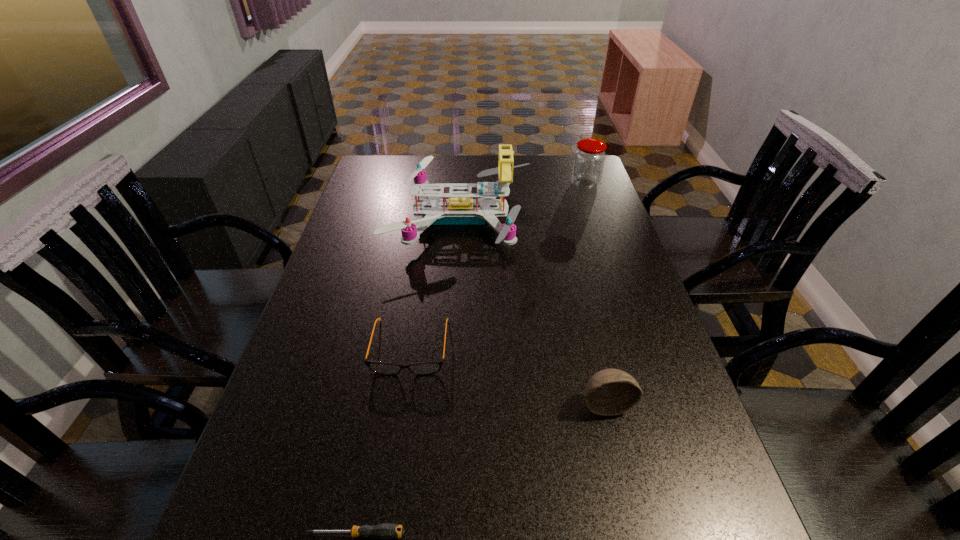
Identify the location of drone. (460, 209).

You are a GUI agent. You are given a task and a screenshot of the screen. Output one action in this format:
    pyautogui.click(x=<x>, y=<y>)
    Task: Click on the second tallest object
    Image resolution: width=960 pixels, height=540 pixels.
    Given the screenshot: What is the action you would take?
    pyautogui.click(x=589, y=158)

Find the location of a particular element. This screenshot has height=540, width=960. jar is located at coordinates (589, 158).

Find the location of a particular element. Image resolution: width=960 pixels, height=540 pixels. bowl is located at coordinates (609, 392).

Where is `the fourth object from left to right`? Image resolution: width=960 pixels, height=540 pixels. the fourth object from left to right is located at coordinates (609, 392).

Find the location of a particular element. Image resolution: width=960 pixels, height=540 pixels. the third farthest object is located at coordinates (424, 368).

What are the coordinates of `spectacles` in the screenshot? It's located at (424, 368).

Image resolution: width=960 pixels, height=540 pixels. In order to click on blank space located 0.270m on the front-facing side of the tallest object in this screenshot , I will do [615, 219].

The width and height of the screenshot is (960, 540). Identify the location of free space located on the back of the rightmost object. (580, 169).

Where is `blank space located 0.260m on the back of the fourth object from left to right`? This screenshot has width=960, height=540. blank space located 0.260m on the back of the fourth object from left to right is located at coordinates (582, 307).